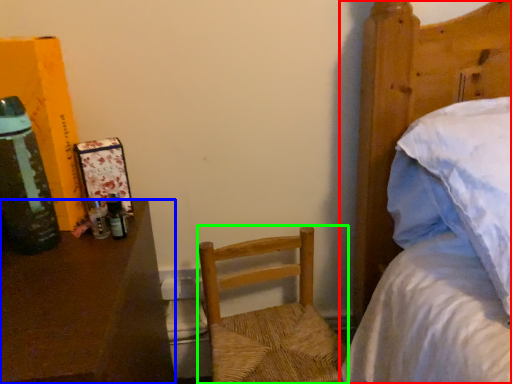
Question: Which is nearer to the bed (highlighted by a red box)? desk (highlighted by a blue box) or chair (highlighted by a green box).

Choices:
 (A) desk
 (B) chair

Answer: (B)